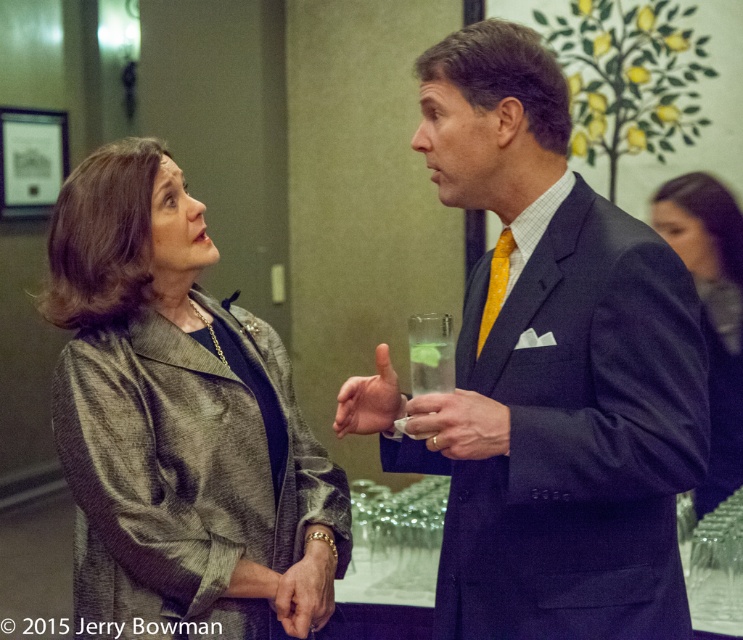
Can you confirm if matte gray blazer at center is smaller than yellow satin tie at right?

No, matte gray blazer at center is not smaller than yellow satin tie at right.

Can you confirm if matte gray blazer at center is shorter than yellow satin tie at right?

Incorrect, matte gray blazer at center's height does not fall short of yellow satin tie at right's.

Is point (108, 429) positioned behind point (480, 340)?

Yes, it is.

This screenshot has width=743, height=640. What are the coordinates of `matte gray blazer at center` in the screenshot? It's located at (172, 417).

Locate an element on the screen. The image size is (743, 640). dark blue fabric jacket at right is located at coordinates (710, 310).

Can you confirm if dark blue fabric jacket at right is bigger than matte plastic cup at center?

Indeed, dark blue fabric jacket at right has a larger size compared to matte plastic cup at center.

The width and height of the screenshot is (743, 640). In order to click on dark blue fabric jacket at right in this screenshot , I will do `click(710, 310)`.

Find the location of a particular element. Image resolution: width=743 pixels, height=640 pixels. dark blue fabric jacket at right is located at coordinates (710, 310).

Between point (106, 499) and point (721, 406), which one is positioned in front?

Point (106, 499)

Is matte gray blazer at center wider than dark blue fabric jacket at right?

Yes.

Does point (212, 332) lie in front of point (727, 440)?

Yes.

Where is `matte gray blazer at center`? The image size is (743, 640). matte gray blazer at center is located at coordinates (172, 417).